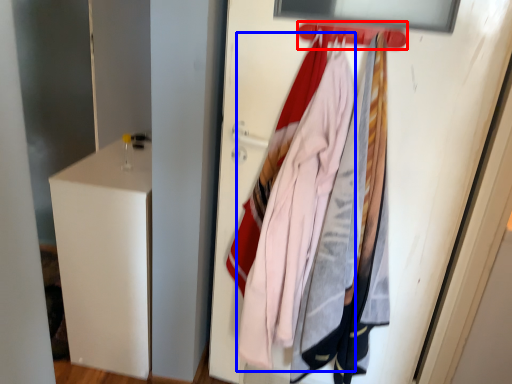
Question: Which of the following is the closest to the observer, hanger (highlighted by a red box) or clothing (highlighted by a blue box)?

Choices:
 (A) hanger
 (B) clothing

Answer: (A)